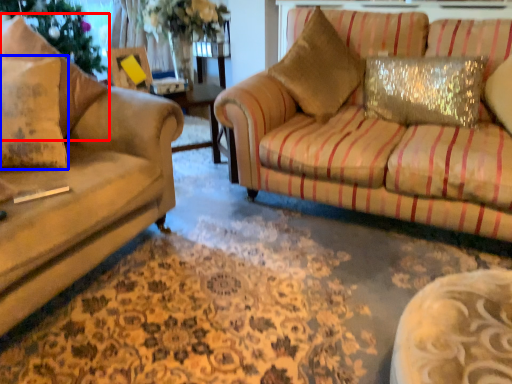
Question: Which of the following is the closest to the observer, pillow (highlighted by a red box) or pillow (highlighted by a blue box)?

Choices:
 (A) pillow
 (B) pillow

Answer: (A)